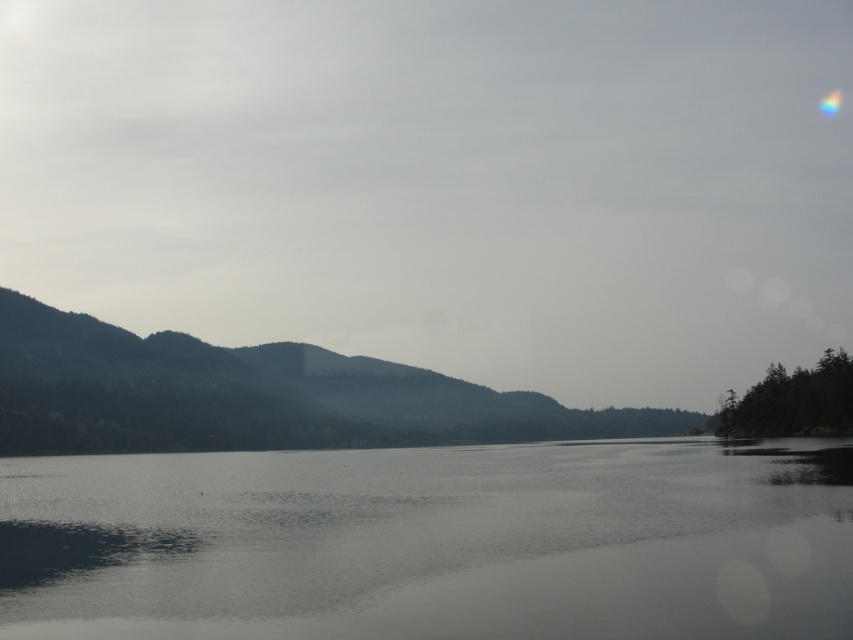
You are standing at the edge of the lake and want to know which object in the scene is taller. Based on the image, which one is taller between the transparent water at center and the green matte forest at left?

The green matte forest at left is taller than the transparent water at center.